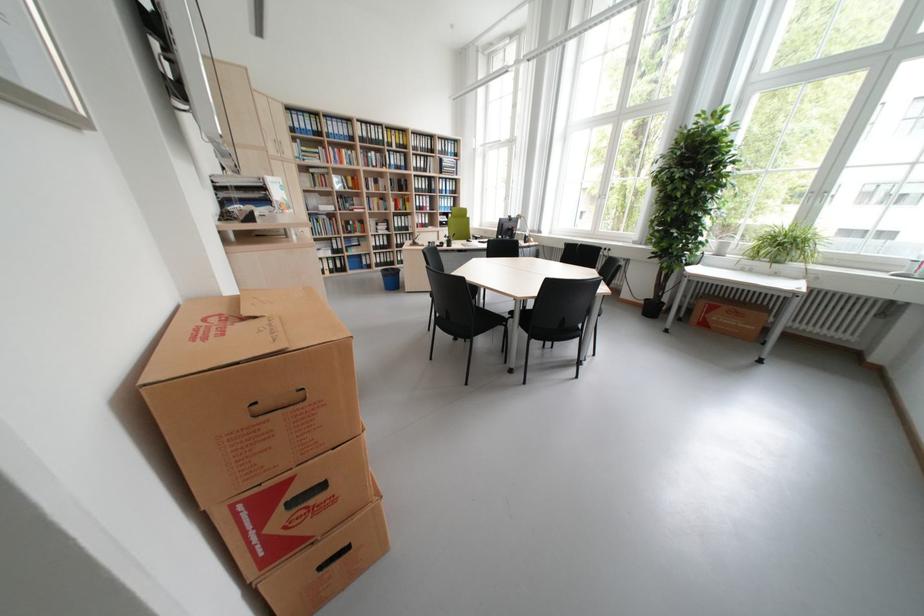
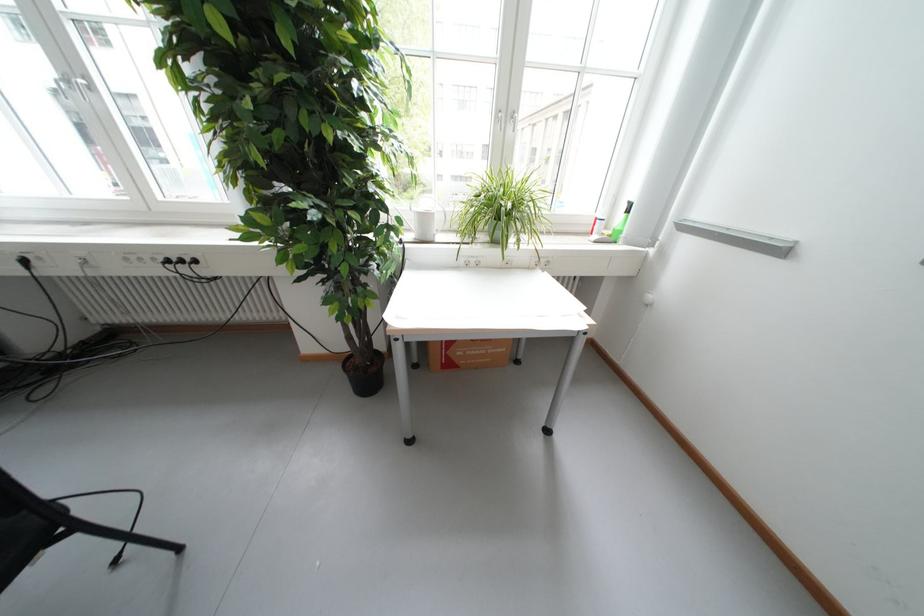
In the second image, find the point that corresponds to point 713,325 in the first image.

(458, 366)